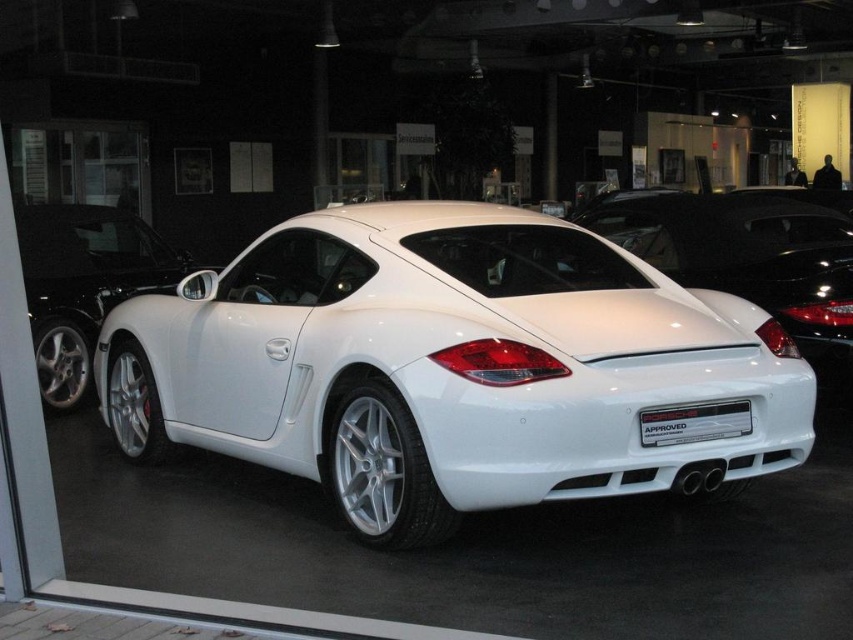
You are a customer looking to buy a car and are standing in the showroom. You see the white glossy car at center and the white metallic sedan at center. Which one is shorter in height?

The white glossy car at center is not as tall as the white metallic sedan at center, so the white glossy car at center is shorter in height.

You are a delivery person who needs to load a white metallic sports car at center and a white metallic sedan at center into a transport truck. The truck has a height limit of 1.6 meters. Given that both cars are white and metallic, can you determine which car might not fit based on their height?

The white metallic sports car at center has a greater height compared to the white metallic sedan at center. Since the sports car is taller, it might not fit within the truck height limit of 1.6 meters, while the sedan could potentially fit.

You are a delivery person who needs to park a delivery van that is 2 meters wide in the showroom. The van must be parked between the white glossy car at center and the white metallic sedan at center. Can the van fit between them?

The white glossy car at center is wider than the white metallic sedan at center. Therefore, the space between them may not be sufficient for a 2 meter wide delivery van. Check the exact width measurements before deciding.